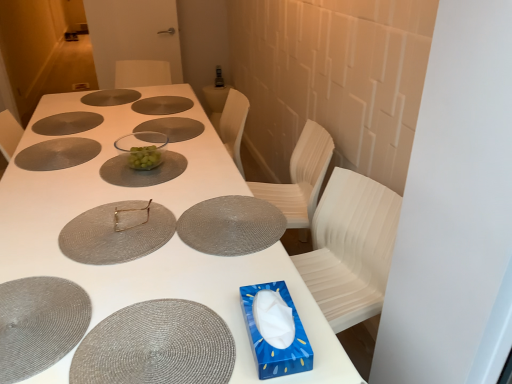
Locate an element on the screen. vacant space behind transparent glass bowl at center, acting as the sixth glass plate starting from the back is located at coordinates (145, 137).